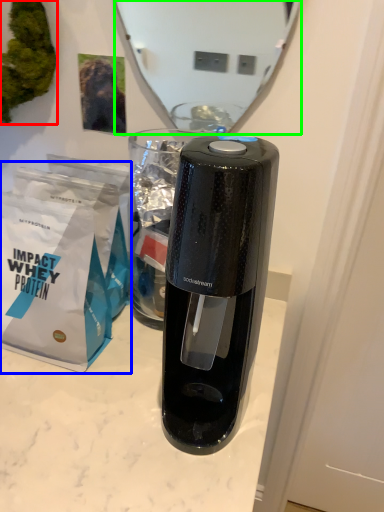
Question: Estimate the real-world distances between objects in this image. Which object is farther from plant (highlighted by a red box), paper bag (highlighted by a blue box) or mirror (highlighted by a green box)?

Choices:
 (A) paper bag
 (B) mirror

Answer: (B)